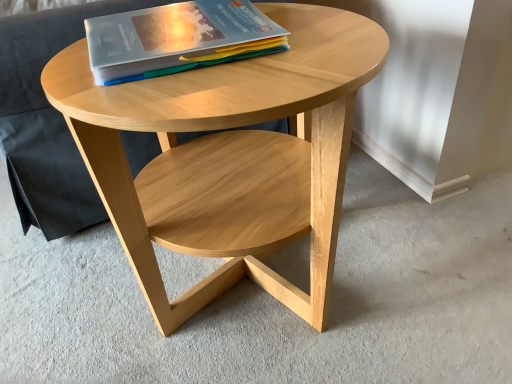
Question: From a real-world perspective, is natural wood coffee table at center under matte plastic book at upper center?

Choices:
 (A) yes
 (B) no

Answer: (A)

Question: Is matte plastic book at upper center a part of natural wood coffee table at center?

Choices:
 (A) yes
 (B) no

Answer: (B)

Question: Is natural wood coffee table at center facing towards matte plastic book at upper center?

Choices:
 (A) yes
 (B) no

Answer: (B)

Question: Is natural wood coffee table at center positioned in front of matte plastic book at upper center?

Choices:
 (A) yes
 (B) no

Answer: (A)

Question: Considering the relative sizes of natural wood coffee table at center and matte plastic book at upper center in the image provided, is natural wood coffee table at center bigger than matte plastic book at upper center?

Choices:
 (A) yes
 (B) no

Answer: (A)

Question: Can you confirm if natural wood coffee table at center is shorter than matte plastic book at upper center?

Choices:
 (A) yes
 (B) no

Answer: (B)

Question: Is matte plastic book at upper center further to camera compared to natural wood coffee table at center?

Choices:
 (A) no
 (B) yes

Answer: (B)

Question: Is natural wood coffee table at center inside matte plastic book at upper center?

Choices:
 (A) yes
 (B) no

Answer: (B)

Question: Is matte plastic book at upper center closer to camera compared to natural wood coffee table at center?

Choices:
 (A) no
 (B) yes

Answer: (A)

Question: From a real-world perspective, is matte plastic book at upper center on top of natural wood coffee table at center?

Choices:
 (A) yes
 (B) no

Answer: (A)

Question: Can you confirm if matte plastic book at upper center is smaller than natural wood coffee table at center?

Choices:
 (A) yes
 (B) no

Answer: (A)

Question: Does matte plastic book at upper center appear on the left side of natural wood coffee table at center?

Choices:
 (A) yes
 (B) no

Answer: (A)

Question: From a real-world perspective, is matte plastic book at upper center positioned above or below natural wood coffee table at center?

Choices:
 (A) below
 (B) above

Answer: (B)